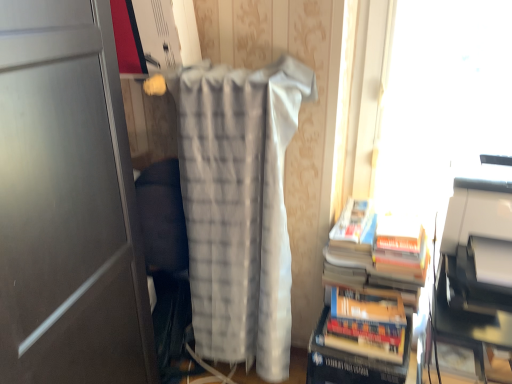
Question: From the image's perspective, would you say white plastic printer at right is positioned over white textured blanket at center?

Choices:
 (A) yes
 (B) no

Answer: (A)

Question: From a real-world perspective, does white plastic printer at right sit lower than white textured blanket at center?

Choices:
 (A) no
 (B) yes

Answer: (A)

Question: Does white plastic printer at right appear on the right side of white textured blanket at center?

Choices:
 (A) no
 (B) yes

Answer: (B)

Question: Is white plastic printer at right positioned beyond the bounds of white textured blanket at center?

Choices:
 (A) no
 (B) yes

Answer: (B)

Question: Does white plastic printer at right have a larger size compared to white textured blanket at center?

Choices:
 (A) no
 (B) yes

Answer: (A)

Question: From a real-world perspective, is white plastic printer at right over white textured blanket at center?

Choices:
 (A) no
 (B) yes

Answer: (B)

Question: Does white textured blanket at center have a lesser width compared to hardcover books at right?

Choices:
 (A) yes
 (B) no

Answer: (A)

Question: Does white textured blanket at center come behind hardcover books at right?

Choices:
 (A) no
 (B) yes

Answer: (A)

Question: Is white textured blanket at center directly adjacent to hardcover books at right?

Choices:
 (A) no
 (B) yes

Answer: (A)

Question: Could you tell me if white textured blanket at center is facing hardcover books at right?

Choices:
 (A) yes
 (B) no

Answer: (B)

Question: From a real-world perspective, is white textured blanket at center beneath hardcover books at right?

Choices:
 (A) yes
 (B) no

Answer: (B)

Question: Considering the relative positions of white textured blanket at center and hardcover books at right in the image provided, is white textured blanket at center in front of hardcover books at right?

Choices:
 (A) no
 (B) yes

Answer: (B)

Question: Would you consider transparent plastic window screen at upper right to be distant from white plastic printer at right?

Choices:
 (A) yes
 (B) no

Answer: (B)